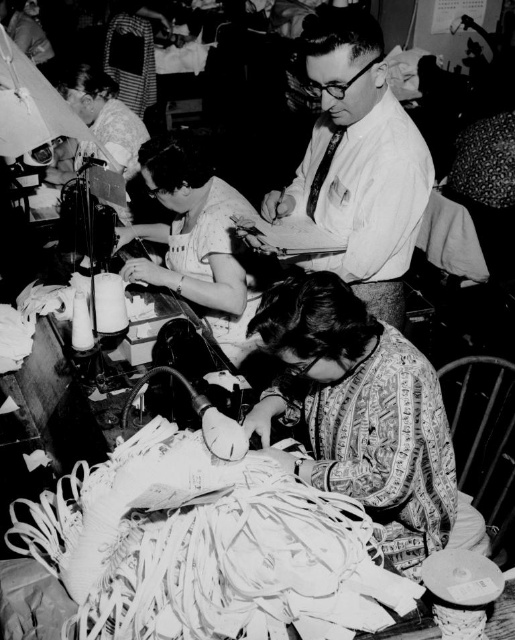
You are a quality inspector in the garment factory. You need to check the patterned fabric at lower center and the matte fabric dress at center. Which one is located lower in the image?

The patterned fabric at lower center is located below the matte fabric dress at center, so the patterned fabric at lower center is lower in the image.

You are a quality inspector in the garment factory. You need to check both the white shirt at center and the matte fabric dress at center. Which one should you check first if you want to start with the one on the left?

The matte fabric dress at center is on the left side of the white shirt at center, so you should check the matte fabric dress at center first.

In the factory scene, there are two items of fabric visible. The first is the patterned fabric at lower center, and the second is the matte fabric dress at center. From the perspective of someone standing in front of the sewing machines, which fabric is positioned more to the right?

The patterned fabric at lower center is positioned to the right of the matte fabric dress at center, so it is more to the right.